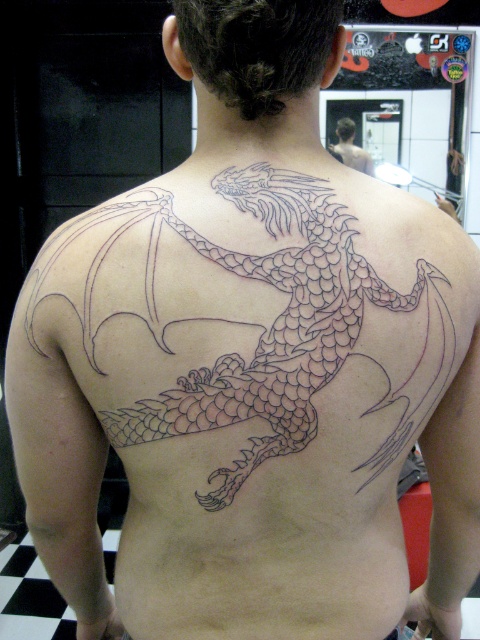
Does black line art dragon at center appear over black ink dragon at upper center?

No.

Based on the photo, which is more to the left, black line art dragon at center or black ink dragon at upper center?

Positioned to the left is black line art dragon at center.

Find the location of a particular element. black line art dragon at center is located at coordinates (277, 324).